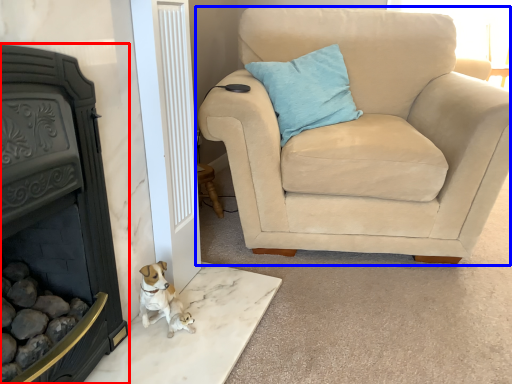
Question: Which point is further to the camera, fireplace (highlighted by a red box) or chair (highlighted by a blue box)?

Choices:
 (A) fireplace
 (B) chair

Answer: (B)